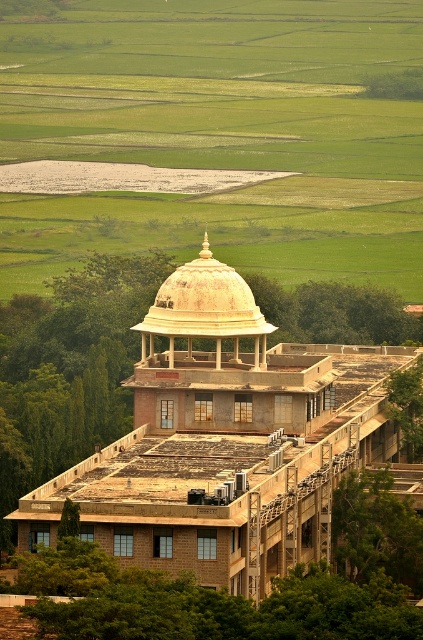
Question: Can you confirm if green grass at upper center is positioned below beige stone dome at center?

Choices:
 (A) no
 (B) yes

Answer: (A)

Question: Where is beige stone dome at center located in relation to golden textured dome at center in the image?

Choices:
 (A) above
 (B) below

Answer: (B)

Question: Which object appears farthest from the camera in this image?

Choices:
 (A) green grass at upper center
 (B) beige stone dome at center

Answer: (A)

Question: Considering the real-world distances, which object is closest to the golden textured dome at center?

Choices:
 (A) beige stone dome at center
 (B) green grass at upper center

Answer: (A)

Question: Does beige stone dome at center have a lesser width compared to golden textured dome at center?

Choices:
 (A) no
 (B) yes

Answer: (A)

Question: Which is farther from the golden textured dome at center?

Choices:
 (A) green grass at upper center
 (B) beige stone dome at center

Answer: (A)